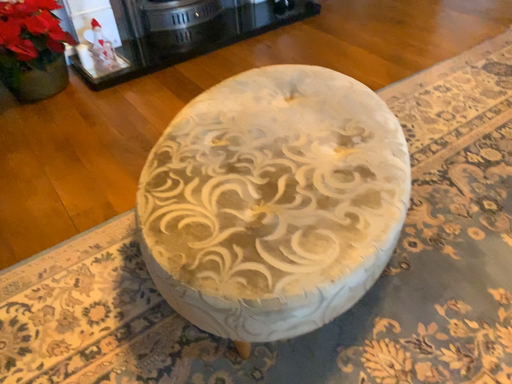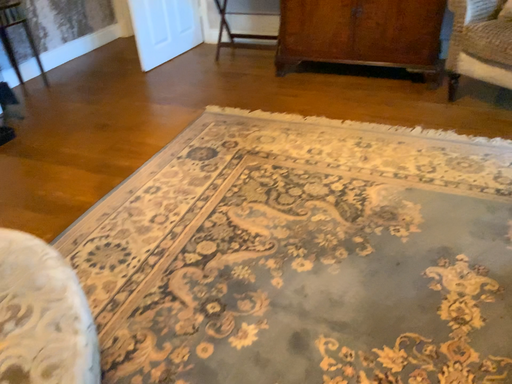
Question: Which way did the camera rotate in the video?

Choices:
 (A) rotated left
 (B) rotated right

Answer: (B)